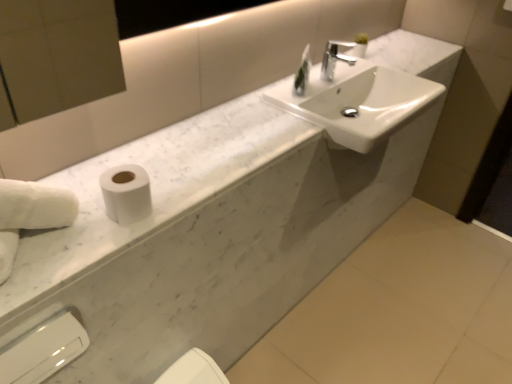
Identify the location of free point to the right of white fluffy hand towel at left. This screenshot has height=384, width=512. (94, 236).